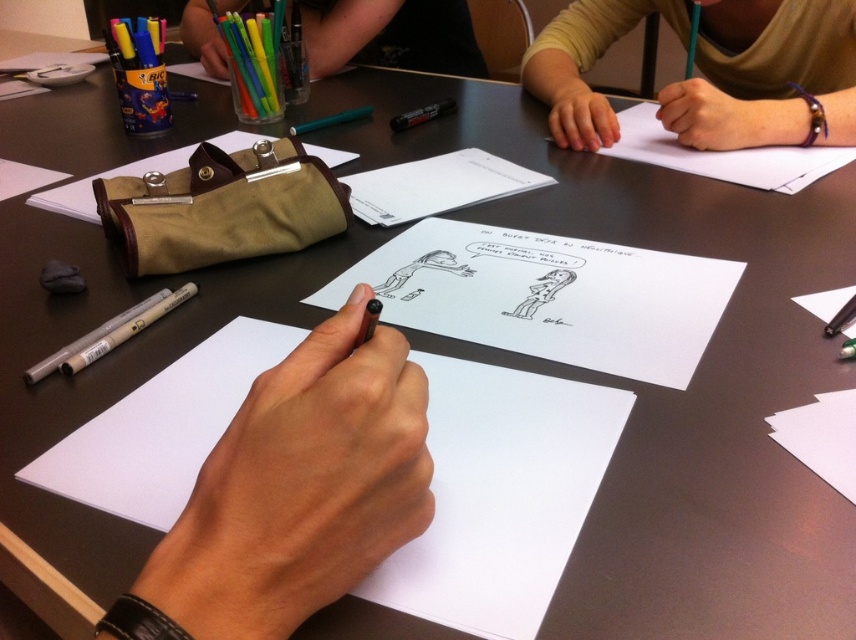
Question: Which point appears closest to the camera in this image?

Choices:
 (A) (684, 160)
 (B) (724, 145)
 (C) (574, 3)

Answer: (A)

Question: Which point appears closest to the camera in this image?

Choices:
 (A) (675, 93)
 (B) (557, 77)
 (C) (559, 70)
 (D) (220, 54)

Answer: (A)

Question: Can you confirm if smooth skin hand at upper right is positioned to the left of matte skin hand at upper right?

Choices:
 (A) yes
 (B) no

Answer: (B)

Question: Where is matte beige pencil case at upper center located in relation to white paper at upper right in the image?

Choices:
 (A) above
 (B) below

Answer: (A)

Question: Can you confirm if black smooth pen at center is positioned to the left of smooth skin hand at upper right?

Choices:
 (A) yes
 (B) no

Answer: (A)

Question: Which object is farther from the camera taking this photo?

Choices:
 (A) white paper at upper right
 (B) matte beige pencil case at upper center

Answer: (B)